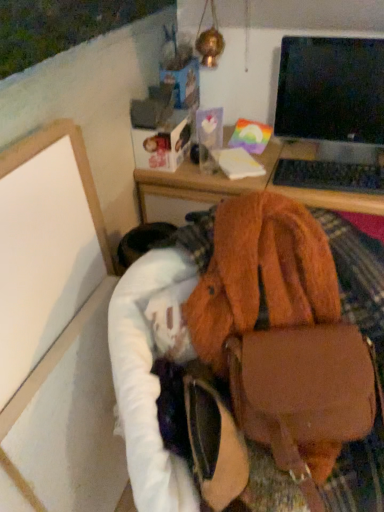
Question: Does brown leather handbag at lower right have a larger size compared to white matte board at lower left?

Choices:
 (A) no
 (B) yes

Answer: (B)

Question: Is brown leather handbag at lower right positioned far away from white matte board at lower left?

Choices:
 (A) yes
 (B) no

Answer: (B)

Question: Is brown leather handbag at lower right turned away from white matte board at lower left?

Choices:
 (A) yes
 (B) no

Answer: (B)

Question: From a real-world perspective, is brown leather handbag at lower right physically above white matte board at lower left?

Choices:
 (A) no
 (B) yes

Answer: (A)

Question: Is brown leather handbag at lower right facing towards white matte board at lower left?

Choices:
 (A) no
 (B) yes

Answer: (A)

Question: Considering the relative positions of brown leather handbag at lower right and white matte board at lower left in the image provided, is brown leather handbag at lower right to the right of white matte board at lower left from the viewer's perspective?

Choices:
 (A) no
 (B) yes

Answer: (B)

Question: Can we say white matte board at lower left lies outside brown leather handbag at lower right?

Choices:
 (A) yes
 (B) no

Answer: (A)

Question: Can you confirm if white matte board at lower left is thinner than brown leather handbag at lower right?

Choices:
 (A) yes
 (B) no

Answer: (A)

Question: Does white matte board at lower left come behind brown leather handbag at lower right?

Choices:
 (A) no
 (B) yes

Answer: (B)

Question: Is white matte board at lower left in front of brown leather handbag at lower right?

Choices:
 (A) no
 (B) yes

Answer: (A)

Question: Does white matte board at lower left have a greater height compared to brown leather handbag at lower right?

Choices:
 (A) no
 (B) yes

Answer: (B)

Question: From a real-world perspective, is white matte board at lower left physically above brown leather handbag at lower right?

Choices:
 (A) yes
 (B) no

Answer: (A)

Question: Is white matte board at lower left in front of black glossy monitor at upper right?

Choices:
 (A) no
 (B) yes

Answer: (B)